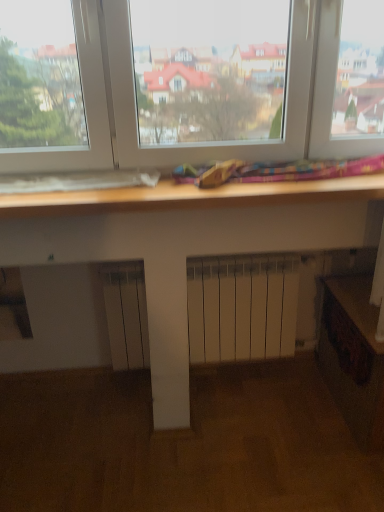
Question: Is wooden at lower right inside or outside of wooden drawer at lower right?

Choices:
 (A) outside
 (B) inside

Answer: (A)

Question: Is point (359, 403) positioned closer to the camera than point (327, 327)?

Choices:
 (A) closer
 (B) farther

Answer: (A)

Question: Considering the positions of wooden at lower right and wooden drawer at lower right in the image, is wooden at lower right wider or thinner than wooden drawer at lower right?

Choices:
 (A) thin
 (B) wide

Answer: (B)

Question: Considering the positions of wooden drawer at lower right and wooden at lower right in the image, is wooden drawer at lower right bigger or smaller than wooden at lower right?

Choices:
 (A) big
 (B) small

Answer: (B)

Question: In the image, is wooden drawer at lower right positioned in front of or behind wooden at lower right?

Choices:
 (A) front
 (B) behind

Answer: (B)

Question: From the image's perspective, is wooden drawer at lower right positioned above or below wooden at lower right?

Choices:
 (A) above
 (B) below

Answer: (A)

Question: From a real-world perspective, relative to wooden at lower right, is wooden drawer at lower right vertically above or below?

Choices:
 (A) above
 (B) below

Answer: (A)